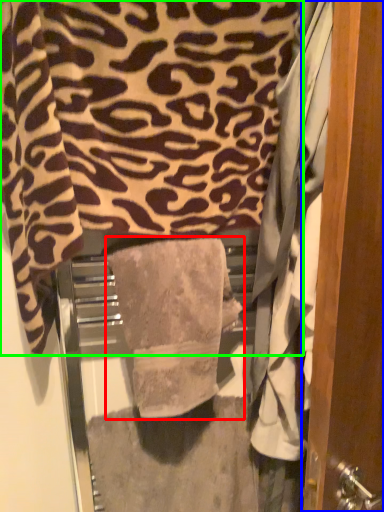
Question: Which object is positioned closest to towel (highlighted by a red box)? Select from door (highlighted by a blue box) and towel (highlighted by a green box).

Choices:
 (A) door
 (B) towel

Answer: (B)